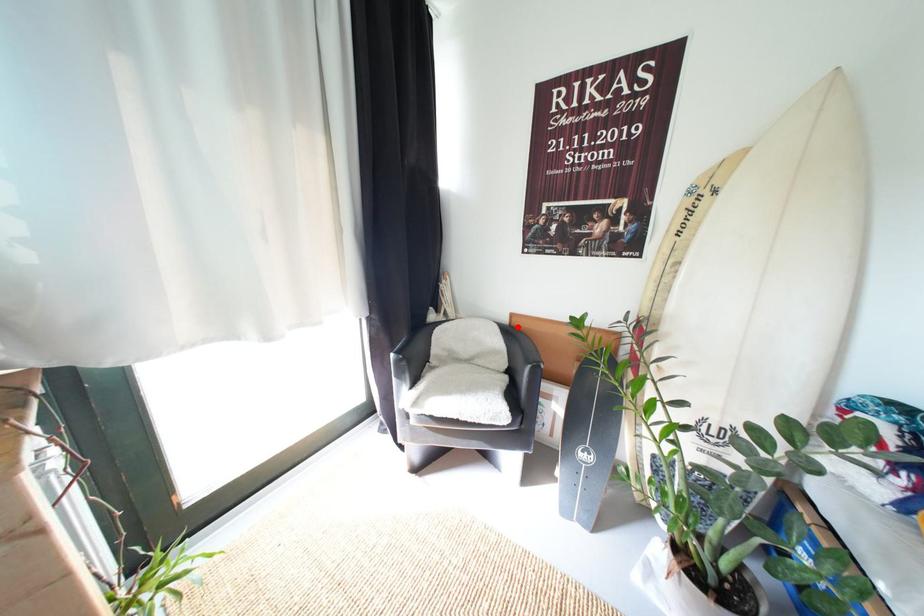
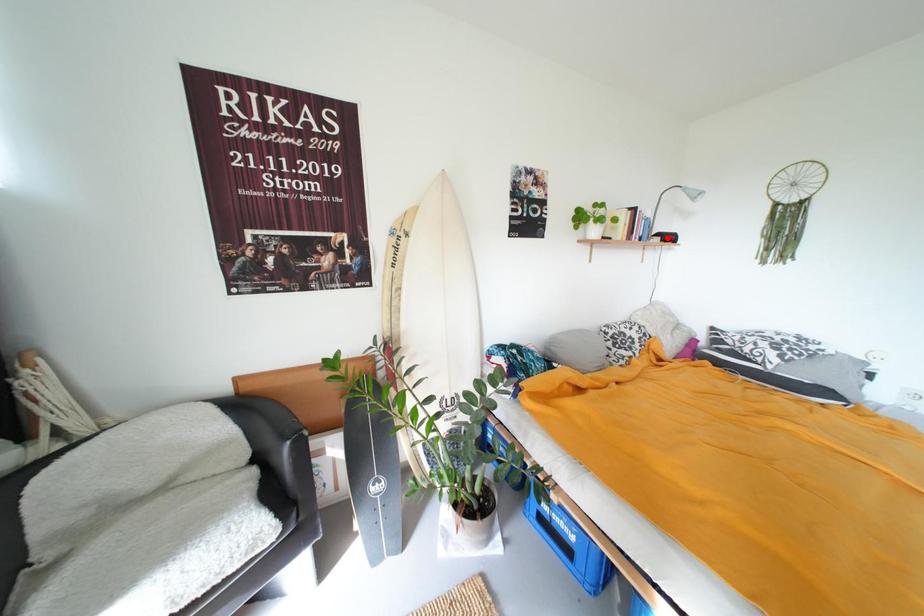
I am providing you with two images of the same scene from different viewpoints. A red point is marked on the first image and another point is marked on the second image. Does the point marked in image1 correspond to the same location as the one in image2?

No